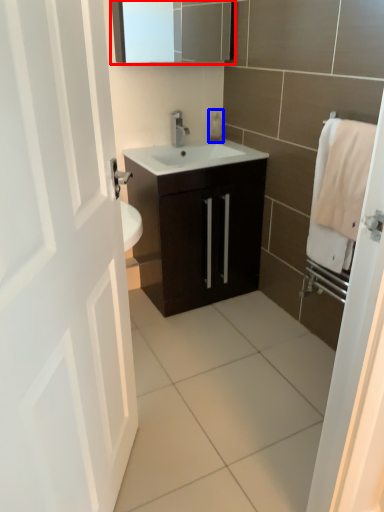
Question: Which point is further to the camera, medicine cabinet (highlighted by a red box) or soap dispenser (highlighted by a blue box)?

Choices:
 (A) medicine cabinet
 (B) soap dispenser

Answer: (B)